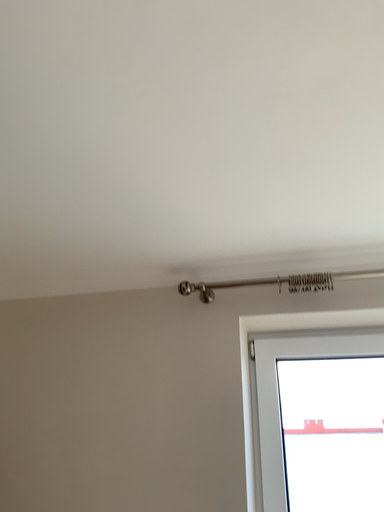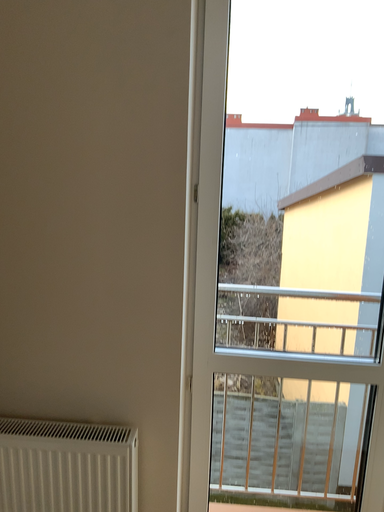
Question: Which way did the camera rotate in the video?

Choices:
 (A) rotated downward
 (B) rotated upward

Answer: (A)